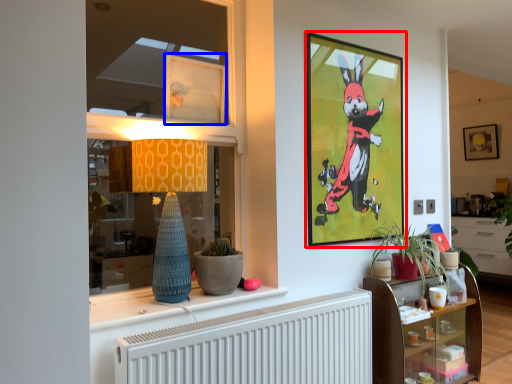
Question: Which object appears closest to the camera in this image, picture frame (highlighted by a red box) or picture frame (highlighted by a blue box)?

Choices:
 (A) picture frame
 (B) picture frame

Answer: (B)